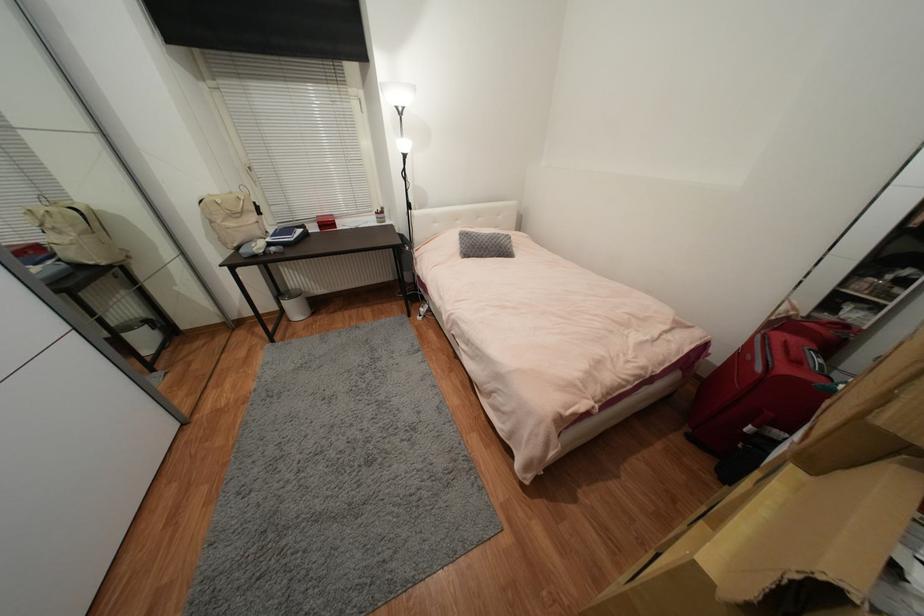
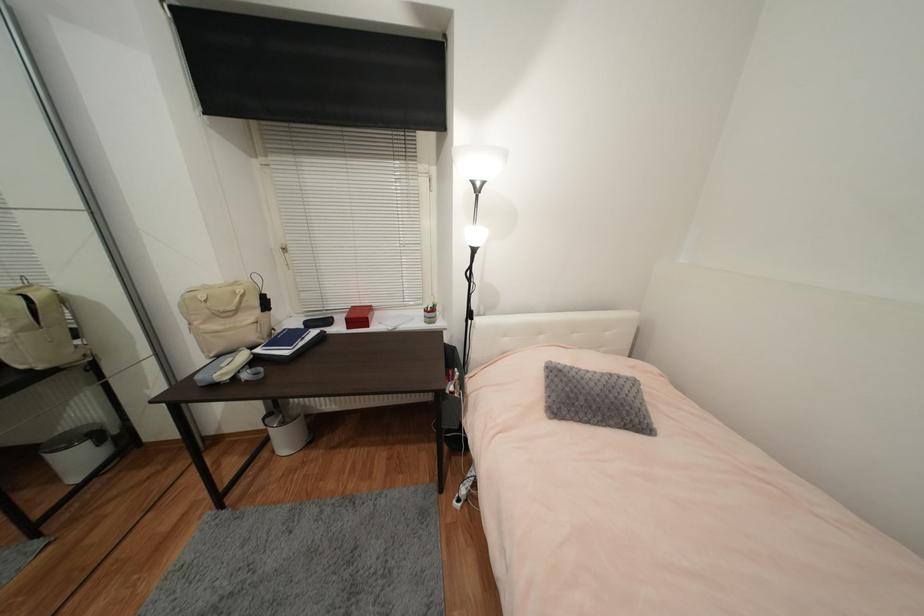
The point at (416, 209) is marked in the first image. Where is the corresponding point in the second image?

(477, 320)